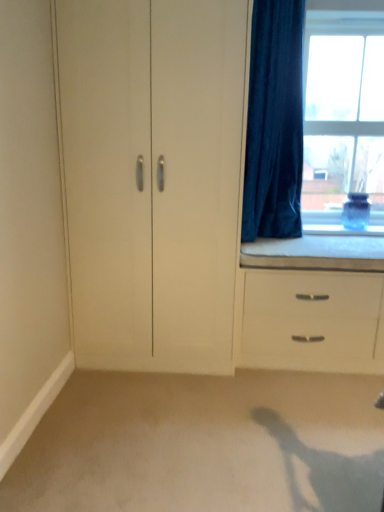
At what (x,y) coordinates should I click in order to perform the action: click on empty space that is ontop of clear glass window at upper right (from a real-world perspective). Please return your answer as a coordinate pair (x, y). Looking at the image, I should click on (352, 14).